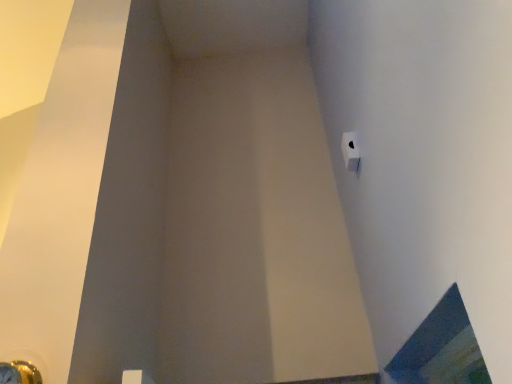
Question: From the image's perspective, is white matte toilet paper at upper right located above blue glass window at lower right?

Choices:
 (A) yes
 (B) no

Answer: (A)

Question: Can you confirm if white matte toilet paper at upper right is positioned to the left of blue glass window at lower right?

Choices:
 (A) no
 (B) yes

Answer: (B)

Question: From the image's perspective, is white matte toilet paper at upper right below blue glass window at lower right?

Choices:
 (A) no
 (B) yes

Answer: (A)

Question: Can you confirm if white matte toilet paper at upper right is bigger than blue glass window at lower right?

Choices:
 (A) yes
 (B) no

Answer: (B)

Question: Considering the relative positions of white matte toilet paper at upper right and blue glass window at lower right in the image provided, is white matte toilet paper at upper right in front of blue glass window at lower right?

Choices:
 (A) no
 (B) yes

Answer: (A)

Question: Is white matte toilet paper at upper right wider or thinner than metallic gold door handle at lower left?

Choices:
 (A) thin
 (B) wide

Answer: (A)

Question: Would you say white matte toilet paper at upper right is to the left or to the right of metallic gold door handle at lower left in the picture?

Choices:
 (A) left
 (B) right

Answer: (B)

Question: Is white matte toilet paper at upper right bigger or smaller than metallic gold door handle at lower left?

Choices:
 (A) small
 (B) big

Answer: (A)

Question: Do you think white matte toilet paper at upper right is within metallic gold door handle at lower left, or outside of it?

Choices:
 (A) outside
 (B) inside

Answer: (A)

Question: Considering the relative positions of metallic gold door handle at lower left and blue glass window at lower right in the image provided, is metallic gold door handle at lower left to the left or to the right of blue glass window at lower right?

Choices:
 (A) left
 (B) right

Answer: (A)

Question: In terms of size, does metallic gold door handle at lower left appear bigger or smaller than blue glass window at lower right?

Choices:
 (A) big
 (B) small

Answer: (B)

Question: Considering their positions, is metallic gold door handle at lower left located in front of or behind blue glass window at lower right?

Choices:
 (A) front
 (B) behind

Answer: (B)

Question: From a real-world perspective, relative to blue glass window at lower right, is metallic gold door handle at lower left vertically above or below?

Choices:
 (A) below
 (B) above

Answer: (A)

Question: Based on their sizes in the image, would you say blue glass window at lower right is bigger or smaller than white matte toilet paper at upper right?

Choices:
 (A) big
 (B) small

Answer: (A)

Question: Does point (435, 337) appear closer or farther from the camera than point (346, 147)?

Choices:
 (A) closer
 (B) farther

Answer: (A)